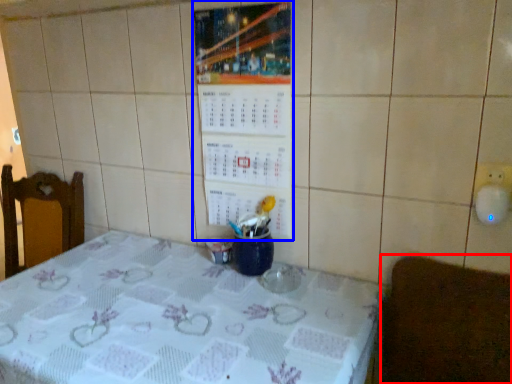
Question: Which of the following is the closest to the observer, furniture (highlighted by a red box) or bulletin board (highlighted by a blue box)?

Choices:
 (A) furniture
 (B) bulletin board

Answer: (A)